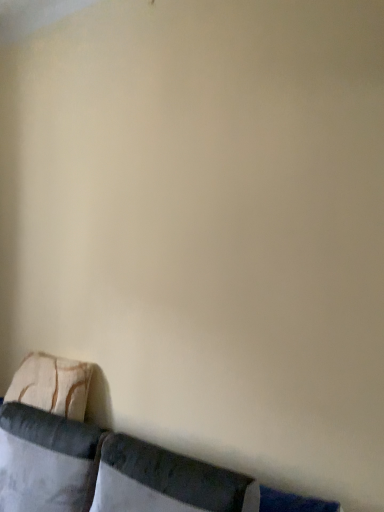
At what (x,y) coordinates should I click in order to perform the action: click on textured beige pillow at lower left, marked as the third pillow in a front-to-back arrangement. Please return your answer as a coordinate pair (x, y). The width and height of the screenshot is (384, 512). Looking at the image, I should click on (52, 385).

The image size is (384, 512). What are the coordinates of `textured beige pillow at lower left, the first pillow from the back` in the screenshot? It's located at (52, 385).

Considering the relative positions of white fabric pillow at lower left, which appears as the 2th pillow when viewed from the back, and velvet cushion at lower left in the image provided, is white fabric pillow at lower left, which appears as the 2th pillow when viewed from the back, to the right of velvet cushion at lower left from the viewer's perspective?

No, white fabric pillow at lower left, which appears as the 2th pillow when viewed from the back, is not to the right of velvet cushion at lower left.

Do you think white fabric pillow at lower left, the second pillow in the front-to-back sequence, is within velvet cushion at lower left, or outside of it?

white fabric pillow at lower left, the second pillow in the front-to-back sequence, is enclosed within velvet cushion at lower left.

Can you see white fabric pillow at lower left, which appears as the 2th pillow when viewed from the back, touching velvet cushion at lower left?

Indeed, white fabric pillow at lower left, which appears as the 2th pillow when viewed from the back, and velvet cushion at lower left are beside each other and touching.

How distant is velvet dark gray pillow at lower center, arranged as the first pillow when viewed from the front, from textured beige pillow at lower left, marked as the third pillow in a front-to-back arrangement?

velvet dark gray pillow at lower center, arranged as the first pillow when viewed from the front, is 27.02 inches from textured beige pillow at lower left, marked as the third pillow in a front-to-back arrangement.

Does velvet dark gray pillow at lower center, which ranks as the 3th pillow in back-to-front order, appear on the right side of textured beige pillow at lower left, the first pillow from the back?

Correct, you'll find velvet dark gray pillow at lower center, which ranks as the 3th pillow in back-to-front order, to the right of textured beige pillow at lower left, the first pillow from the back.

Is velvet dark gray pillow at lower center, which ranks as the 3th pillow in back-to-front order, smaller than textured beige pillow at lower left, the first pillow from the back?

Incorrect, velvet dark gray pillow at lower center, which ranks as the 3th pillow in back-to-front order, is not smaller in size than textured beige pillow at lower left, the first pillow from the back.

I want to click on pillow that is above the velvet dark gray pillow at lower center, which ranks as the 3th pillow in back-to-front order (from a real-world perspective), so click(52, 385).

Based on the photo, from a real-world perspective, is velvet dark gray pillow at lower center, which ranks as the 3th pillow in back-to-front order, beneath velvet cushion at lower left?

Actually, velvet dark gray pillow at lower center, which ranks as the 3th pillow in back-to-front order, is physically above velvet cushion at lower left in the real world.

Does velvet dark gray pillow at lower center, which ranks as the 3th pillow in back-to-front order, have a lesser width compared to velvet cushion at lower left?

→ Indeed, velvet dark gray pillow at lower center, which ranks as the 3th pillow in back-to-front order, has a lesser width compared to velvet cushion at lower left.

From a real-world perspective, count 2nd pillows upward from the velvet cushion at lower left and point to it. Please provide its 2D coordinates.

[(166, 481)]

Who is smaller, textured beige pillow at lower left, marked as the third pillow in a front-to-back arrangement, or velvet dark gray pillow at lower center, which ranks as the 3th pillow in back-to-front order?

Smaller between the two is textured beige pillow at lower left, marked as the third pillow in a front-to-back arrangement.

Locate an element on the screen. The image size is (384, 512). the 1st pillow below the textured beige pillow at lower left, the first pillow from the back (from the image's perspective) is located at coordinates (166, 481).

Looking at this image, does textured beige pillow at lower left, the first pillow from the back, have a greater width compared to velvet dark gray pillow at lower center, arranged as the first pillow when viewed from the front?

In fact, textured beige pillow at lower left, the first pillow from the back, might be narrower than velvet dark gray pillow at lower center, arranged as the first pillow when viewed from the front.

Consider the image. Is textured beige pillow at lower left, the first pillow from the back, situated inside velvet dark gray pillow at lower center, arranged as the first pillow when viewed from the front, or outside?

textured beige pillow at lower left, the first pillow from the back, lies outside velvet dark gray pillow at lower center, arranged as the first pillow when viewed from the front.

Would you say textured beige pillow at lower left, marked as the third pillow in a front-to-back arrangement, is outside white fabric pillow at lower left, the second pillow in the front-to-back sequence?

Yes, textured beige pillow at lower left, marked as the third pillow in a front-to-back arrangement, is not within white fabric pillow at lower left, the second pillow in the front-to-back sequence.

From a real-world perspective, which is physically below, textured beige pillow at lower left, marked as the third pillow in a front-to-back arrangement, or white fabric pillow at lower left, the second pillow in the front-to-back sequence?

From a 3D spatial view, white fabric pillow at lower left, the second pillow in the front-to-back sequence, is below.

Considering the relative sizes of textured beige pillow at lower left, marked as the third pillow in a front-to-back arrangement, and white fabric pillow at lower left, which appears as the 2th pillow when viewed from the back, in the image provided, is textured beige pillow at lower left, marked as the third pillow in a front-to-back arrangement, thinner than white fabric pillow at lower left, which appears as the 2th pillow when viewed from the back,?

Indeed, textured beige pillow at lower left, marked as the third pillow in a front-to-back arrangement, has a lesser width compared to white fabric pillow at lower left, which appears as the 2th pillow when viewed from the back.

Considering the relative positions of textured beige pillow at lower left, the first pillow from the back, and white fabric pillow at lower left, the second pillow in the front-to-back sequence, in the image provided, is textured beige pillow at lower left, the first pillow from the back, behind white fabric pillow at lower left, the second pillow in the front-to-back sequence,?

Yes, textured beige pillow at lower left, the first pillow from the back, is further from the viewer.

Does velvet cushion at lower left contain textured beige pillow at lower left, marked as the third pillow in a front-to-back arrangement?

Yes, textured beige pillow at lower left, marked as the third pillow in a front-to-back arrangement, can be found within velvet cushion at lower left.

Looking at their sizes, would you say velvet cushion at lower left is wider or thinner than textured beige pillow at lower left, marked as the third pillow in a front-to-back arrangement?

velvet cushion at lower left is wider than textured beige pillow at lower left, marked as the third pillow in a front-to-back arrangement.

Considering the positions of point (250, 509) and point (59, 410), is point (250, 509) closer or farther from the camera than point (59, 410)?

Point (250, 509) appears to be closer to the viewer than point (59, 410).

How different are the orientations of textured beige pillow at lower left, the first pillow from the back, and velvet cushion at lower left in degrees?

5.17 degrees.

Considering the points (12, 392) and (145, 483), which point is in front, point (12, 392) or point (145, 483)?

The point (145, 483) is in front.

Is textured beige pillow at lower left, marked as the third pillow in a front-to-back arrangement, positioned beyond the bounds of velvet cushion at lower left?

No, textured beige pillow at lower left, marked as the third pillow in a front-to-back arrangement, is not outside of velvet cushion at lower left.

Is textured beige pillow at lower left, marked as the third pillow in a front-to-back arrangement, smaller than velvet cushion at lower left?

Yes, textured beige pillow at lower left, marked as the third pillow in a front-to-back arrangement, is smaller than velvet cushion at lower left.

Locate an element on the screen. The width and height of the screenshot is (384, 512). furniture on the right of white fabric pillow at lower left, which appears as the 2th pillow when viewed from the back is located at coordinates (96, 456).

Where is `pillow above the velvet dark gray pillow at lower center, arranged as the first pillow when viewed from the front (from a real-world perspective)`? pillow above the velvet dark gray pillow at lower center, arranged as the first pillow when viewed from the front (from a real-world perspective) is located at coordinates (52, 385).

Which object lies nearer to the anchor point velvet dark gray pillow at lower center, arranged as the first pillow when viewed from the front, textured beige pillow at lower left, the first pillow from the back, or velvet cushion at lower left?

velvet cushion at lower left.

Estimate the real-world distances between objects in this image. Which object is closer to textured beige pillow at lower left, the first pillow from the back, velvet cushion at lower left or white fabric pillow at lower left, which appears as the 2th pillow when viewed from the back?

Among the two, velvet cushion at lower left is located nearer to textured beige pillow at lower left, the first pillow from the back.

Estimate the real-world distances between objects in this image. Which object is closer to velvet cushion at lower left, white fabric pillow at lower left, which appears as the 2th pillow when viewed from the back, or textured beige pillow at lower left, the first pillow from the back?

white fabric pillow at lower left, which appears as the 2th pillow when viewed from the back, is closer to velvet cushion at lower left.

Looking at the image, which one is located further to white fabric pillow at lower left, the second pillow in the front-to-back sequence, velvet dark gray pillow at lower center, which ranks as the 3th pillow in back-to-front order, or velvet cushion at lower left?

Based on the image, velvet dark gray pillow at lower center, which ranks as the 3th pillow in back-to-front order, appears to be further to white fabric pillow at lower left, the second pillow in the front-to-back sequence.

When comparing their distances from velvet cushion at lower left, does velvet dark gray pillow at lower center, arranged as the first pillow when viewed from the front, or white fabric pillow at lower left, the second pillow in the front-to-back sequence, seem further?

velvet dark gray pillow at lower center, arranged as the first pillow when viewed from the front, lies further to velvet cushion at lower left than the other object.

Estimate the real-world distances between objects in this image. Which object is further from velvet cushion at lower left, textured beige pillow at lower left, the first pillow from the back, or white fabric pillow at lower left, the second pillow in the front-to-back sequence?

The object further to velvet cushion at lower left is textured beige pillow at lower left, the first pillow from the back.

Estimate the real-world distances between objects in this image. Which object is closer to velvet dark gray pillow at lower center, which ranks as the 3th pillow in back-to-front order, white fabric pillow at lower left, the second pillow in the front-to-back sequence, or velvet cushion at lower left?

The object closer to velvet dark gray pillow at lower center, which ranks as the 3th pillow in back-to-front order, is velvet cushion at lower left.

Which object lies nearer to the anchor point white fabric pillow at lower left, which appears as the 2th pillow when viewed from the back, velvet dark gray pillow at lower center, arranged as the first pillow when viewed from the front, or textured beige pillow at lower left, the first pillow from the back?

textured beige pillow at lower left, the first pillow from the back, lies closer to white fabric pillow at lower left, which appears as the 2th pillow when viewed from the back, than the other object.

Find the location of a particular element. pillow located between velvet cushion at lower left and white fabric pillow at lower left, which appears as the 2th pillow when viewed from the back, in the depth direction is located at coordinates [x=166, y=481].

You are a GUI agent. You are given a task and a screenshot of the screen. Output one action in this format:
    pyautogui.click(x=<x>, y=<y>)
    Task: Click on the pillow positioned between velvet dark gray pillow at lower center, which ranks as the 3th pillow in back-to-front order, and textured beige pillow at lower left, the first pillow from the back, from near to far
    This screenshot has width=384, height=512.
    Given the screenshot: What is the action you would take?
    pyautogui.click(x=46, y=461)